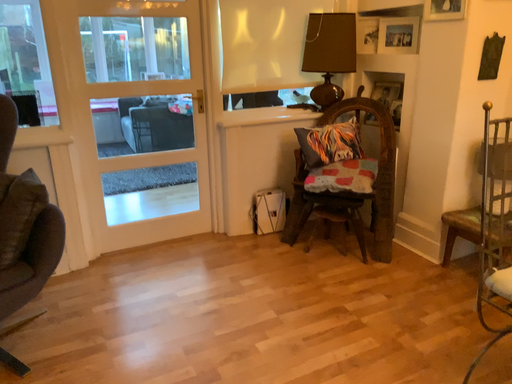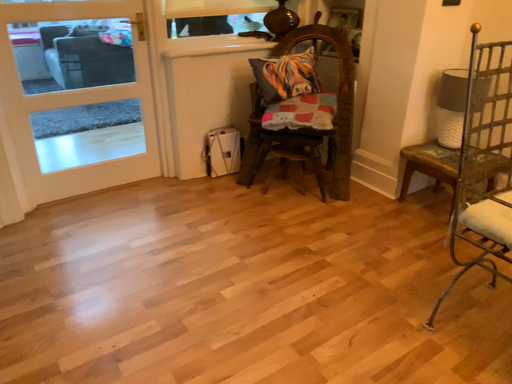
Question: How did the camera likely rotate when shooting the video?

Choices:
 (A) rotated left
 (B) rotated right

Answer: (B)